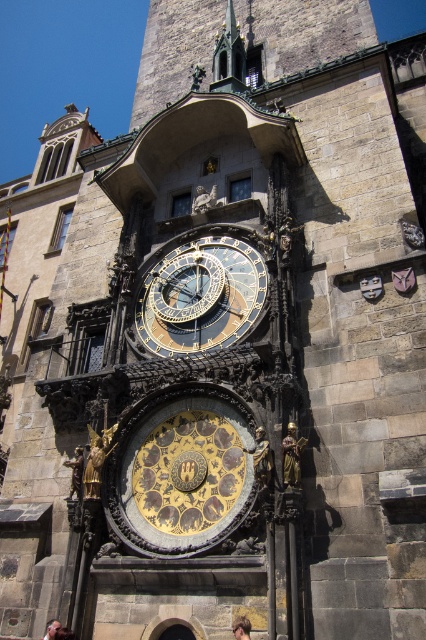
You are an architect visiting the Prague Astronomical Clock. You notice the gold metallic clock at center and the golden hair at center. Which object is taller?

The gold metallic clock at center is taller than the golden hair at center.